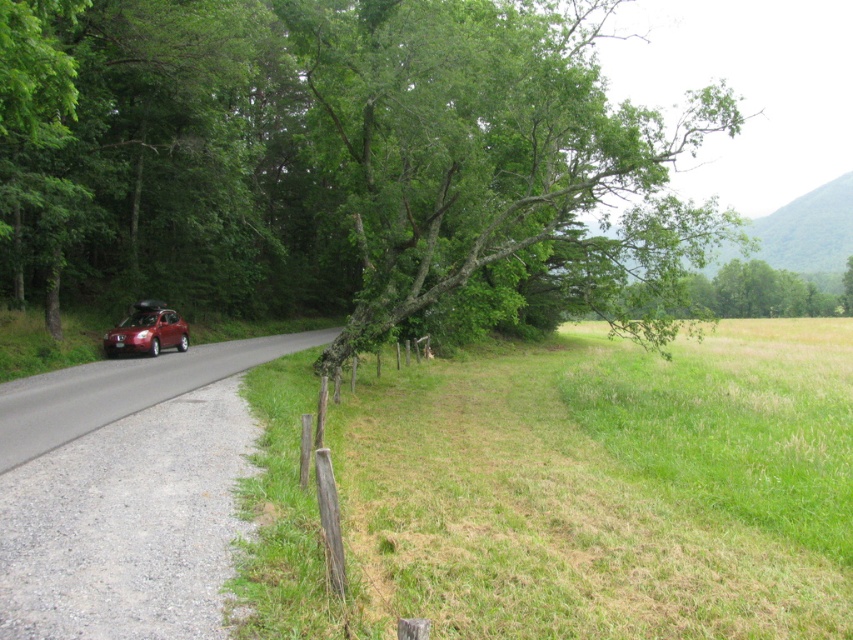
Is point (424, 196) less distant than point (114, 330)?

That is True.

Can you confirm if green leafy tree at center is positioned above satin red suv at center-left?

Correct, green leafy tree at center is located above satin red suv at center-left.

Image resolution: width=853 pixels, height=640 pixels. Describe the element at coordinates (497, 157) in the screenshot. I see `green leafy tree at center` at that location.

This screenshot has width=853, height=640. In order to click on green leafy tree at center in this screenshot , I will do `click(497, 157)`.